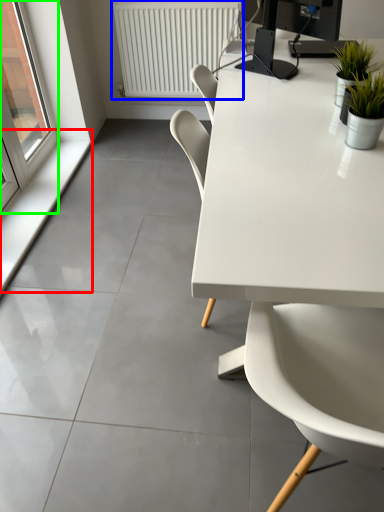
Question: Based on their relative distances, which object is nearer to window sill (highlighted by a red box)? Choose from radiator (highlighted by a blue box) and window (highlighted by a green box).

Choices:
 (A) radiator
 (B) window

Answer: (B)